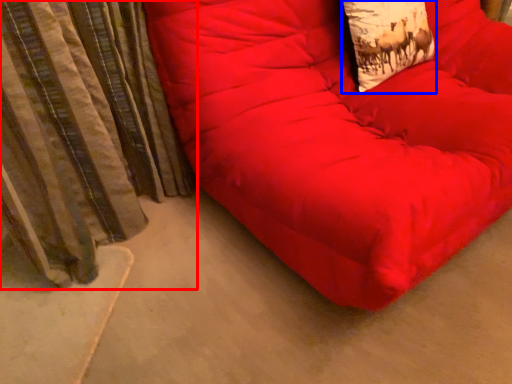
Question: Which of the following is the closest to the observer, curtain (highlighted by a red box) or throw pillow (highlighted by a blue box)?

Choices:
 (A) curtain
 (B) throw pillow

Answer: (A)